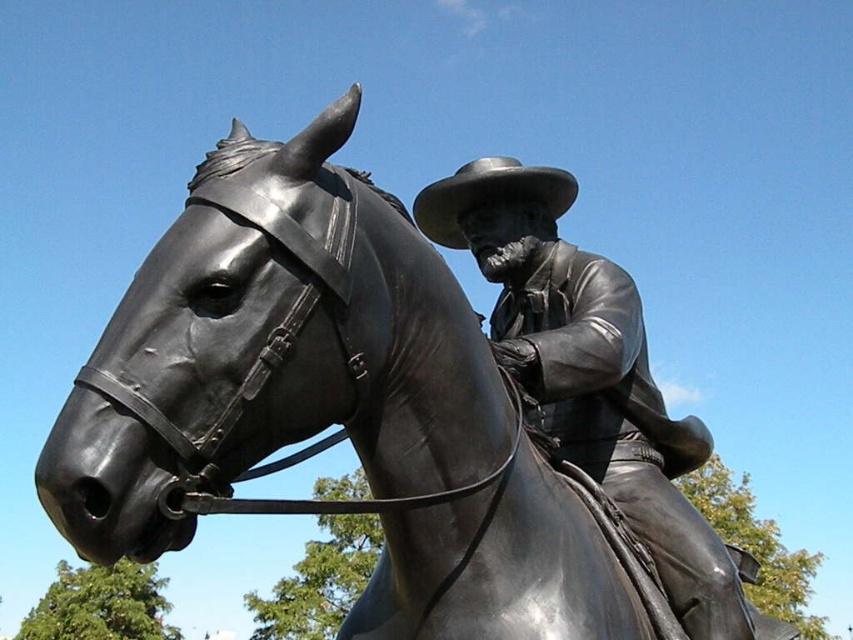
You are a sculptor examining the statue of the polished bronze cowboy at center and the matte brown cowboy hat at center. Which object is taller?

The polished bronze cowboy at center is taller than the matte brown cowboy hat at center.

What are the exact coordinates of the polished bronze cowboy at center in the image?

The polished bronze cowboy at center is located at point (589,371).